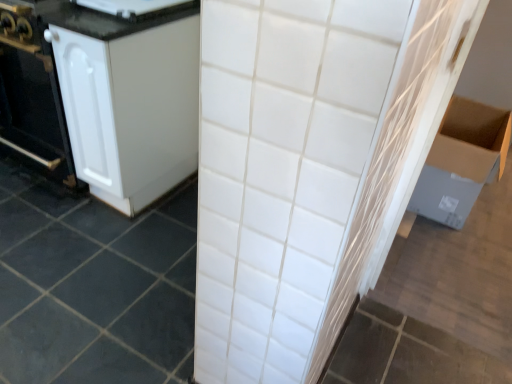
Question: Is white matte cabinet at left taller than white ceramic tile at center?

Choices:
 (A) no
 (B) yes

Answer: (B)

Question: Does white matte cabinet at left appear on the left side of white ceramic tile at center?

Choices:
 (A) no
 (B) yes

Answer: (A)

Question: Is white matte cabinet at left touching white ceramic tile at center?

Choices:
 (A) no
 (B) yes

Answer: (A)

Question: Is white matte cabinet at left to the right of white ceramic tile at center from the viewer's perspective?

Choices:
 (A) yes
 (B) no

Answer: (A)

Question: Does white matte cabinet at left have a greater width compared to white ceramic tile at center?

Choices:
 (A) yes
 (B) no

Answer: (B)

Question: From a real-world perspective, relative to white ceramic tile at center, is white matte cabinet at left vertically above or below?

Choices:
 (A) below
 (B) above

Answer: (B)

Question: From the image's perspective, is white matte cabinet at left positioned above or below white ceramic tile at center?

Choices:
 (A) above
 (B) below

Answer: (A)

Question: Is white matte cabinet at left taller or shorter than white ceramic tile at center?

Choices:
 (A) short
 (B) tall

Answer: (B)

Question: Is white matte cabinet at left situated inside white ceramic tile at center or outside?

Choices:
 (A) inside
 (B) outside

Answer: (B)

Question: Based on their positions, is white matte cabinet at left located to the left or right of white glossy refrigerator at upper left?

Choices:
 (A) left
 (B) right

Answer: (A)

Question: Considering the positions of white matte cabinet at left and white glossy refrigerator at upper left in the image, is white matte cabinet at left bigger or smaller than white glossy refrigerator at upper left?

Choices:
 (A) small
 (B) big

Answer: (B)

Question: Considering the positions of point (169, 92) and point (140, 14), is point (169, 92) closer or farther from the camera than point (140, 14)?

Choices:
 (A) farther
 (B) closer

Answer: (A)

Question: From a real-world perspective, relative to white glossy refrigerator at upper left, is white matte cabinet at left vertically above or below?

Choices:
 (A) below
 (B) above

Answer: (A)

Question: Based on their positions, is white ceramic tile at center located to the left or right of cardboard box at right?

Choices:
 (A) left
 (B) right

Answer: (A)

Question: Relative to cardboard box at right, is white ceramic tile at center in front or behind?

Choices:
 (A) behind
 (B) front

Answer: (B)